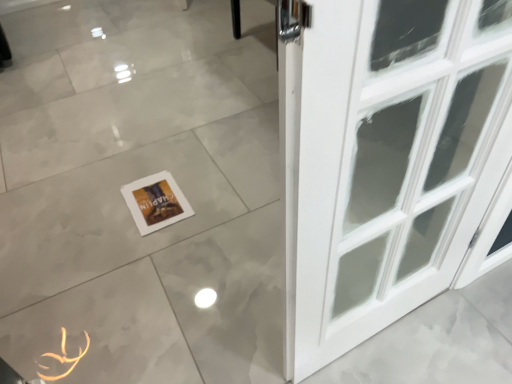
The image size is (512, 384). I want to click on spots to the right of white paper at lower center, so [x=215, y=202].